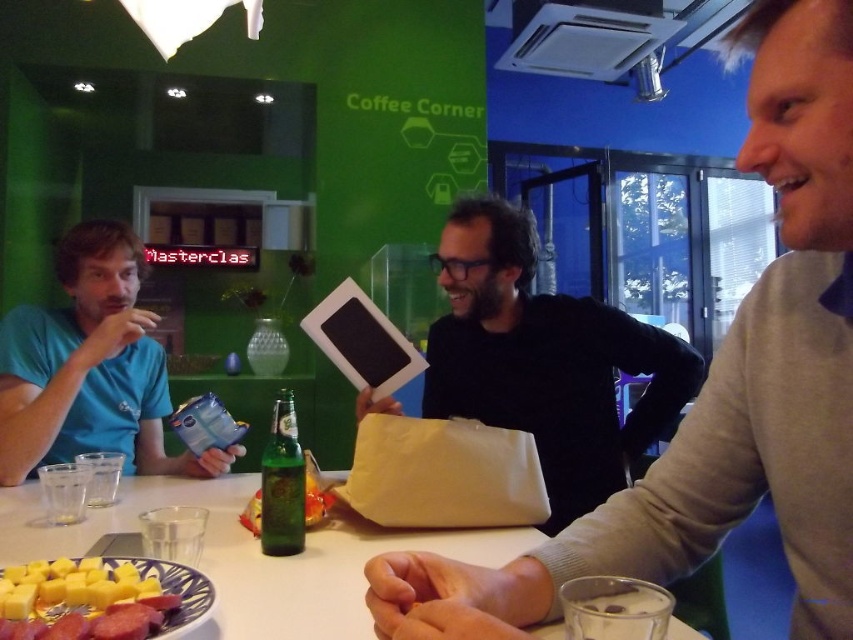
You are a barista at the Coffee Corner. You need to place a new coffee cup on the white glossy table at center. However, there is a smooth gray sweater at upper right on the table. Is there enough space to place the cup without moving the sweater?

The smooth gray sweater at upper right is positioned over white glossy table at center, but since it is only covering part of the table, there might still be space available. However, without knowing the exact size of the sweater or the cup, it is difficult to determine definitively. The user should check the remaining area on the white glossy table at center to ensure the cup fits without overlapping the sweater.

You are a barista at the Coffee Corner. You need to place a new coffee cup that is 10 cm tall on the white glossy table at center. Is there enough vertical space between the smooth gray sweater at upper right and the table to fit the cup without it touching the sweater?

The smooth gray sweater at upper right is taller than the white glossy table at center. Since the sweater is taller, placing a 10 cm tall coffee cup on the table might not leave enough vertical space between them. The cup could potentially touch the sweater if the distance between them is less than 10 cm. However, the exact vertical clearance isn